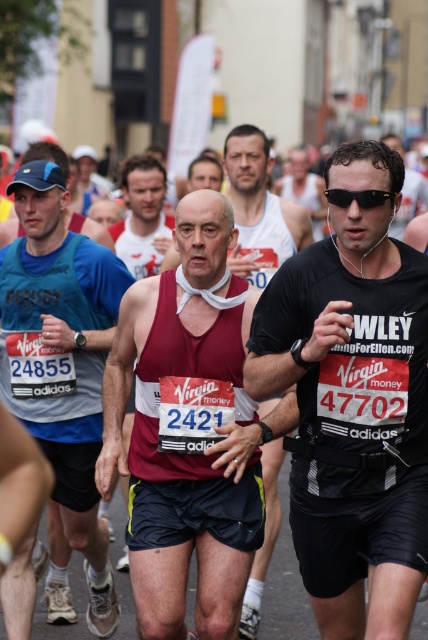
Is black matte t-shirt at center smaller than maroon fabric tank top at center?

No, black matte t-shirt at center is not smaller than maroon fabric tank top at center.

Is black matte t-shirt at center positioned in front of maroon fabric tank top at center?

Yes, it is in front of maroon fabric tank top at center.

Locate an element on the screen. black matte t-shirt at center is located at coordinates (353, 403).

Locate an element on the screen. This screenshot has width=428, height=640. black matte t-shirt at center is located at coordinates (353, 403).

Which is below, maroon fabric tank top at center or matte white tank top at center?

maroon fabric tank top at center is below.

In the scene shown: Between maroon fabric tank top at center and matte white tank top at center, which one is positioned higher?

matte white tank top at center is higher up.

Where is `maroon fabric tank top at center`? maroon fabric tank top at center is located at coordinates (259, 209).

Image resolution: width=428 pixels, height=640 pixels. What do you see at coordinates (62, 358) in the screenshot?
I see `blue fabric tank top at center` at bounding box center [62, 358].

Does blue fabric tank top at center have a smaller size compared to maroon tank top at center?

Actually, blue fabric tank top at center might be larger than maroon tank top at center.

Measure the distance between blue fabric tank top at center and camera.

blue fabric tank top at center is 18.51 feet from camera.

You are a GUI agent. You are given a task and a screenshot of the screen. Output one action in this format:
    pyautogui.click(x=<x>, y=<y>)
    Task: Click on the blue fabric tank top at center
    
    Given the screenshot: What is the action you would take?
    pyautogui.click(x=62, y=358)